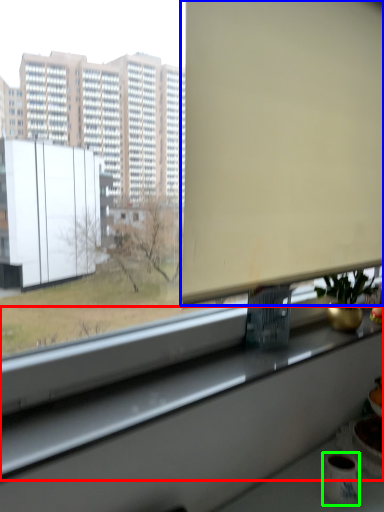
Question: Which object is positioned closest to window sill (highlighted by a red box)? Select from window screen (highlighted by a blue box) and mug (highlighted by a green box).

Choices:
 (A) window screen
 (B) mug

Answer: (B)